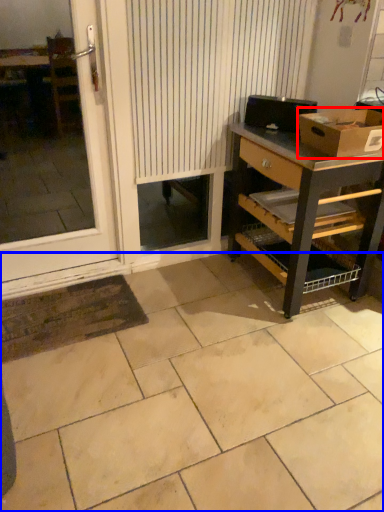
Question: Which object appears farthest to the camera in this image, box (highlighted by a red box) or ceramic tile (highlighted by a blue box)?

Choices:
 (A) box
 (B) ceramic tile

Answer: (A)